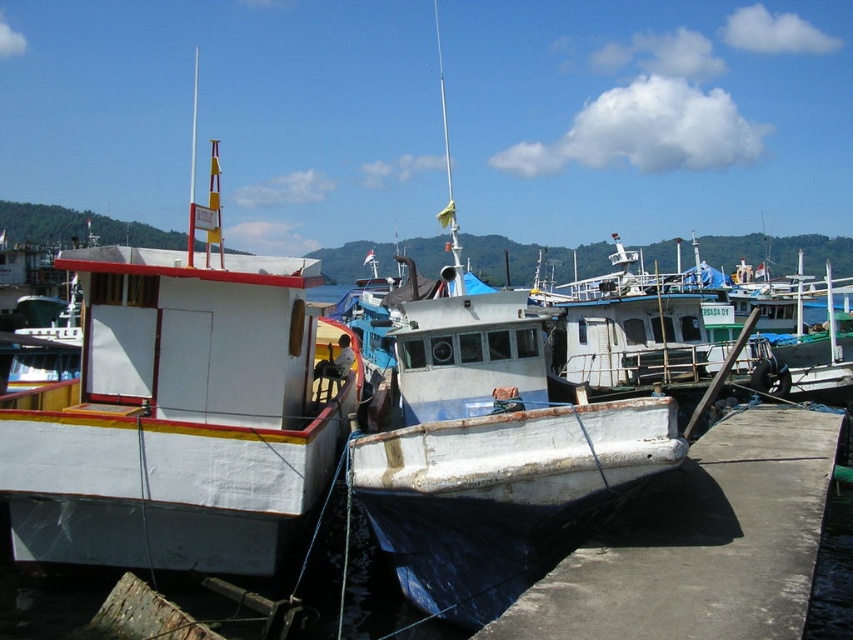
How much distance is there between white matte boat at left and white matte boat at center?

white matte boat at left is 31.28 feet away from white matte boat at center.

Does white matte boat at left have a larger size compared to white matte boat at center?

Yes.

The image size is (853, 640). What do you see at coordinates (175, 417) in the screenshot? I see `white matte boat at left` at bounding box center [175, 417].

At what (x,y) coordinates should I click in order to perform the action: click on white matte boat at left. Please return your answer as a coordinate pair (x, y). Looking at the image, I should click on (175, 417).

The height and width of the screenshot is (640, 853). Find the location of `white matte boat at center`. white matte boat at center is located at coordinates (492, 444).

Can you confirm if white matte boat at center is positioned to the right of white concrete dock at lower right?

Incorrect, white matte boat at center is not on the right side of white concrete dock at lower right.

The width and height of the screenshot is (853, 640). I want to click on white matte boat at center, so click(x=492, y=444).

The image size is (853, 640). I want to click on white matte boat at center, so click(x=492, y=444).

At what (x,y) coordinates should I click in order to perform the action: click on white matte boat at left. Please return your answer as a coordinate pair (x, y). This screenshot has height=640, width=853. Looking at the image, I should click on (175, 417).

Measure the distance between point (x=141, y=285) and camera.

A: Point (x=141, y=285) and camera are 7.49 meters apart.

What do you see at coordinates (175, 417) in the screenshot? I see `white matte boat at left` at bounding box center [175, 417].

Locate an element on the screen. This screenshot has width=853, height=640. white matte boat at left is located at coordinates (175, 417).